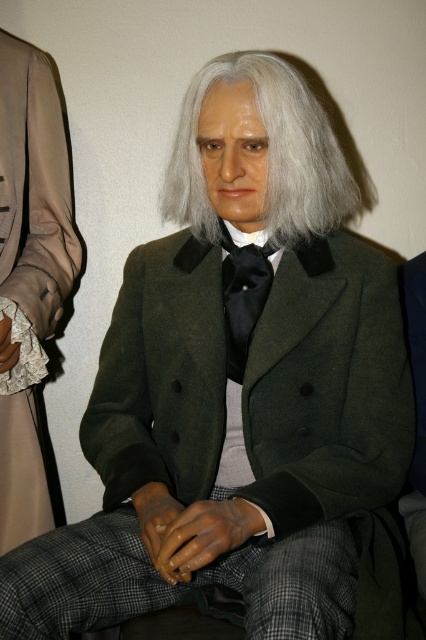
Question: Can you confirm if lace fabric at left is thinner than black satin tie at center?

Choices:
 (A) no
 (B) yes

Answer: (A)

Question: Does green woolen coat at center have a smaller size compared to lace fabric at left?

Choices:
 (A) yes
 (B) no

Answer: (B)

Question: Among these objects, which one is nearest to the camera?

Choices:
 (A) green woolen coat at center
 (B) black satin tie at center
 (C) lace fabric at left

Answer: (A)

Question: Which is farther from the black satin tie at center?

Choices:
 (A) green woolen coat at center
 (B) gray matte hair at center

Answer: (B)

Question: Is green woolen coat at center above gray matte hair at center?

Choices:
 (A) yes
 (B) no

Answer: (B)

Question: Which point appears farthest from the camera in this image?

Choices:
 (A) (268, 140)
 (B) (239, 320)

Answer: (B)